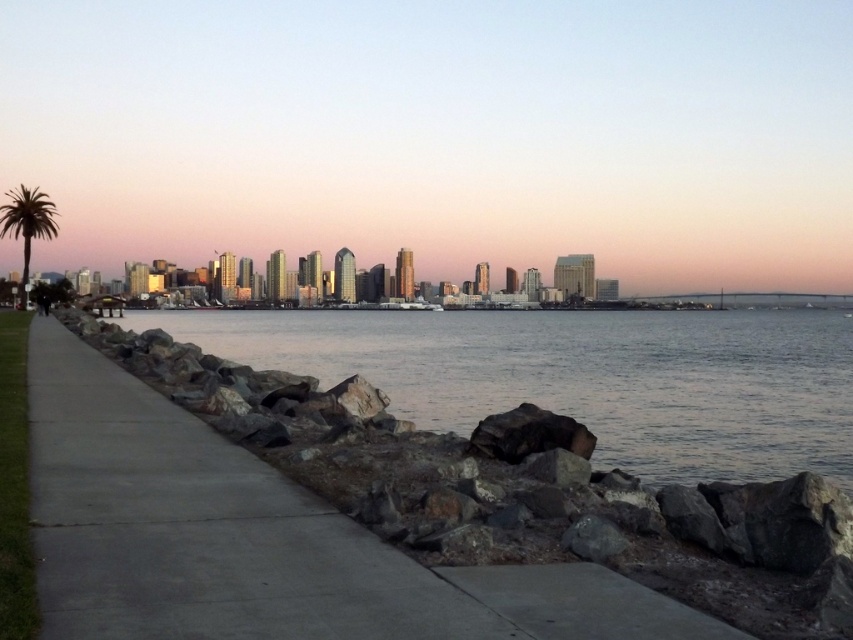
Based on the photo, you are standing on the concrete pathway and want to walk towards the black rock at center and the green leafy palm tree at left. Which object will you reach first?

You will reach the black rock at center first because it is closer to you than the green leafy palm tree at left.

You are a photographer standing on the gray concrete sidewalk at lower left and want to take a photo of the green leafy palm tree at left. Will the palm tree be fully visible in your photo without any obstruction from the sidewalk?

The gray concrete sidewalk at lower left has a lesser height compared to green leafy palm tree at left, so the palm tree will be fully visible in your photo without any obstruction from the sidewalk since the sidewalk is shorter than the tree.

You are standing at the waterfront and want to reach a specific point marked at coordinates point (103, 458). If your walking distance is limited to 10 meters, can you reach that point from where you are currently standing?

The point (103, 458) is 10.29 meters away from the viewer. Since your walking distance is limited to 10 meters, you cannot reach that point.